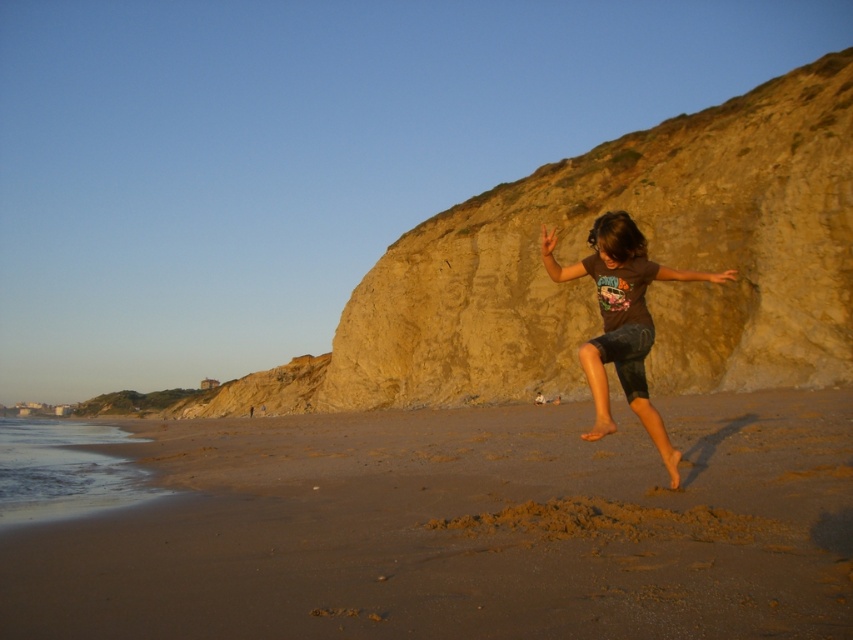
Who is taller, brown sandy beach at center or brown cotton t-shirt at center?

brown cotton t-shirt at center

Who is positioned more to the left, brown sandy beach at center or brown cotton t-shirt at center?

brown sandy beach at center is more to the left.

At what (x,y) coordinates should I click in order to perform the action: click on brown sandy beach at center. Please return your answer as a coordinate pair (x, y). The width and height of the screenshot is (853, 640). Looking at the image, I should click on (462, 529).